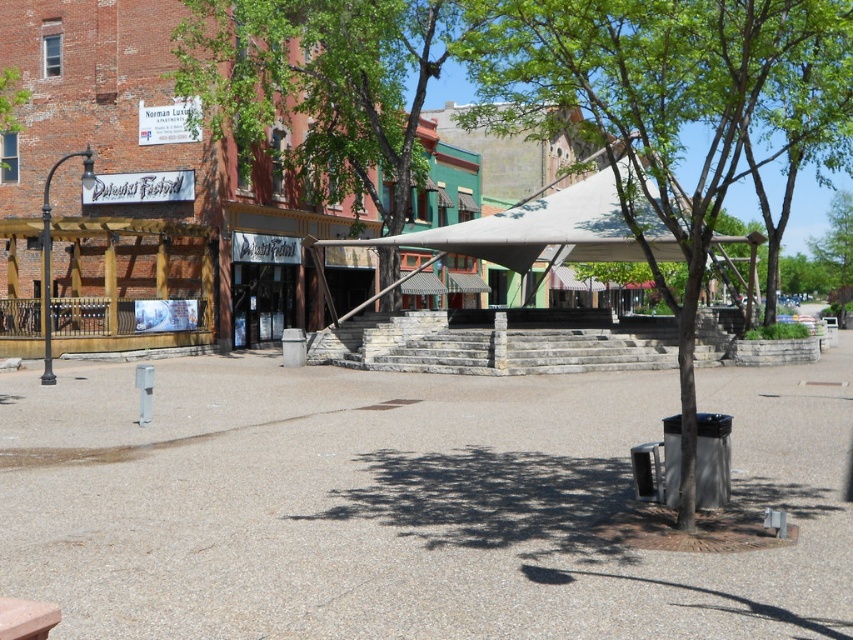
You are standing in the plaza and want to find a spot where you can stay out of the sun. The green leafy tree at center and the white fabric canopy at center are both casting shadows. Which one provides a larger shaded area?

The green leafy tree at center is located above the white fabric canopy at center, so its shadow would likely cover a larger area than the canopy.

You are planning to set up a picnic blanket in the plaza. You want to ensure it is under the shade of the green leafy tree at center or the green leafy tree at upper center. Which tree would provide a larger shaded area for your picnic?

The green leafy tree at center might be wider than green leafy tree at upper center, so it would provide a larger shaded area for your picnic.